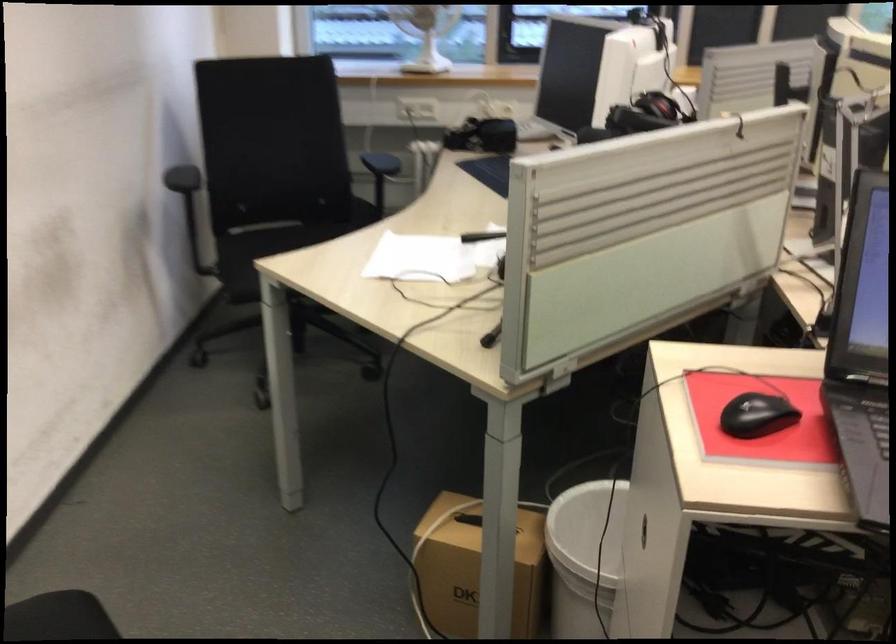
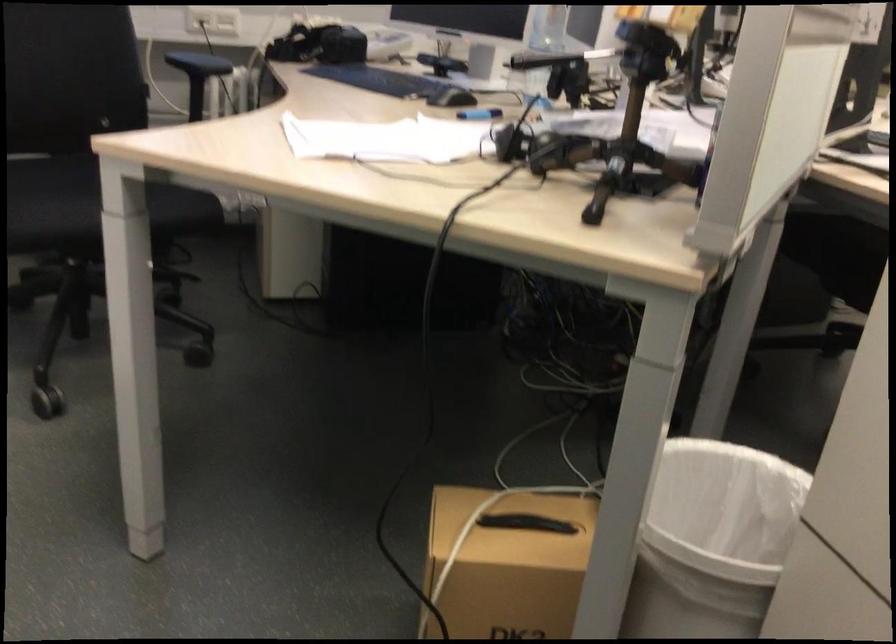
Looking at this image, what movement of the cameraman would produce the second image?

The cameraman walked toward left, forward.